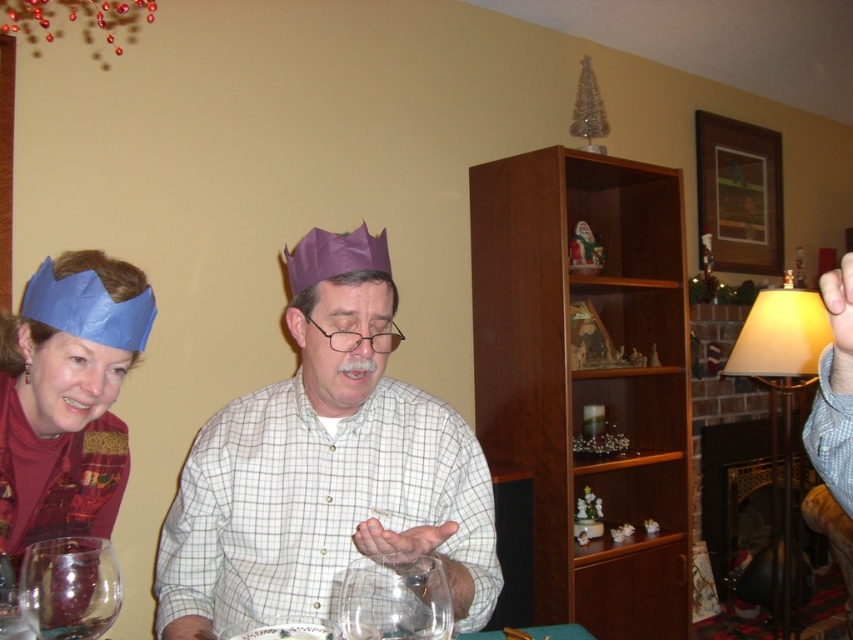
Which is above, purple paper crown at center or transparent glass at center?

purple paper crown at center

Between point (351, 349) and point (347, 582), which one is positioned in front?

Point (347, 582) is in front.

Locate an element on the screen. purple paper crown at center is located at coordinates (325, 467).

Does point (239, 541) lie in front of point (103, 547)?

No, (239, 541) is further to viewer.

Is point (325, 440) more distant than point (90, 612)?

That is True.

The image size is (853, 640). What are the coordinates of `purple paper crown at center` in the screenshot? It's located at (325, 467).

Measure the distance between blue paper crown at left and camera.

They are 38.80 inches apart.

Does point (115, 444) lie in front of point (380, 561)?

No, it is not.

Identify the location of blue paper crown at left. (67, 397).

Where is `blue paper crown at left`? The width and height of the screenshot is (853, 640). blue paper crown at left is located at coordinates (67, 397).